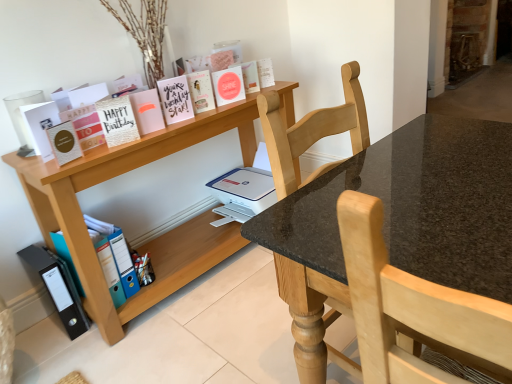
Where is `vacant space in front of matte pink card at upper center, placed as the seventh paperback book when sorted from left to right`? This screenshot has height=384, width=512. vacant space in front of matte pink card at upper center, placed as the seventh paperback book when sorted from left to right is located at coordinates (195, 119).